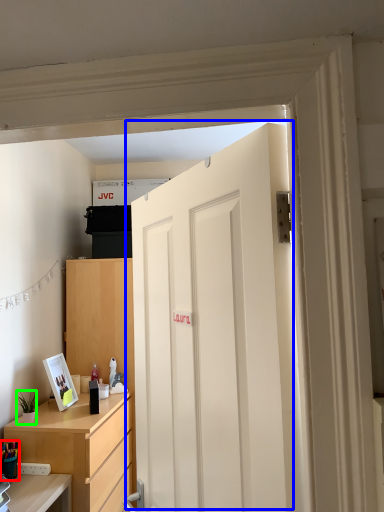
Question: Which is nearer to the stationery (highlighted by a red box)? door (highlighted by a blue box) or houseplant (highlighted by a green box).

Choices:
 (A) door
 (B) houseplant

Answer: (B)